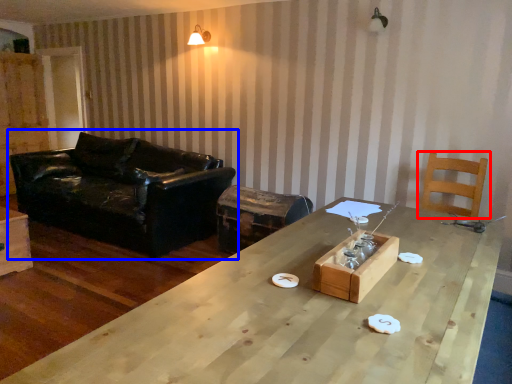
Question: Among these objects, which one is farthest to the camera, chair (highlighted by a red box) or studio couch (highlighted by a blue box)?

Choices:
 (A) chair
 (B) studio couch

Answer: (B)